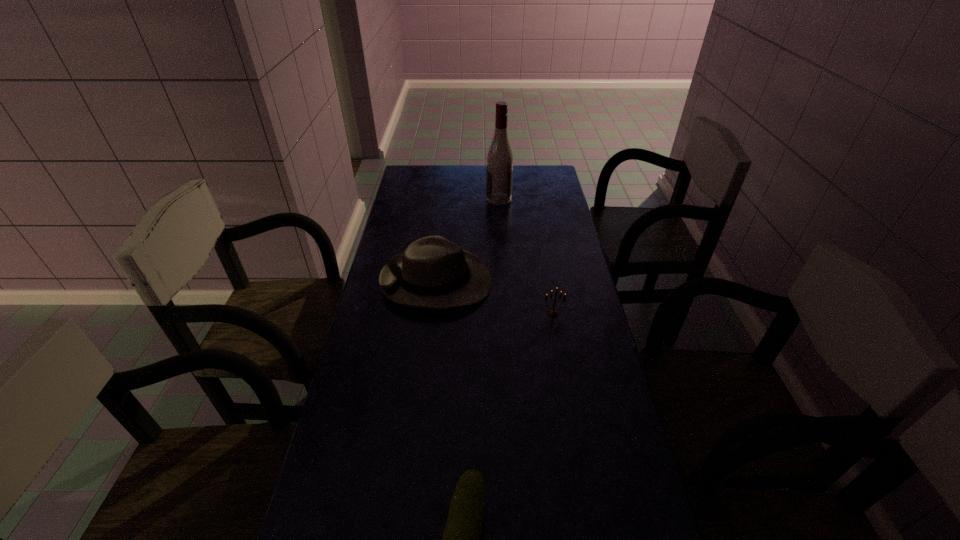
At what (x,y) coordinates should I click in order to perform the action: click on free space between the rightmost object and the third shortest object. Please return your answer as a coordinate pair (x, y). Looking at the image, I should click on (494, 298).

The width and height of the screenshot is (960, 540). What are the coordinates of `object that stands as the second closest to the tallest object` in the screenshot? It's located at (553, 313).

Locate which object is the second closest to the farthest object. Please provide its 2D coordinates. Your answer should be formatted as a tuple, i.e. [(x, y)], where the tuple contains the x and y coordinates of a point satisfying the conditions above.

[(553, 313)]

I want to click on free space that satisfies the following two spatial constraints: 1. on the label of the alcohol; 2. on the left side of the candelabrum, so click(506, 314).

Where is `vacant space that satisfies the following two spatial constraints: 1. on the label of the candelabrum; 2. on the right side of the tallest object`? This screenshot has height=540, width=960. vacant space that satisfies the following two spatial constraints: 1. on the label of the candelabrum; 2. on the right side of the tallest object is located at coordinates (506, 314).

You are a GUI agent. You are given a task and a screenshot of the screen. Output one action in this format:
    pyautogui.click(x=<x>, y=<y>)
    Task: Click on the free space in the image that satisfies the following two spatial constraints: 1. on the back side of the candelabrum; 2. on the label of the alcohol
    
    Given the screenshot: What is the action you would take?
    pyautogui.click(x=533, y=199)

The height and width of the screenshot is (540, 960). Find the location of `vacant area that satisfies the following two spatial constraints: 1. on the front-facing side of the fedora; 2. on the left side of the rightmost object`. vacant area that satisfies the following two spatial constraints: 1. on the front-facing side of the fedora; 2. on the left side of the rightmost object is located at coordinates (433, 314).

Identify the location of free location that satisfies the following two spatial constraints: 1. on the front-facing side of the fedora; 2. on the right side of the rightmost object. This screenshot has height=540, width=960. 433,314.